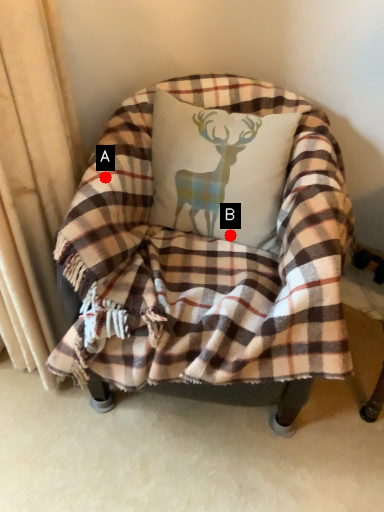
Question: Two points are circled on the image, labeled by A and B beside each circle. Which point is further to the camera?

Choices:
 (A) A is further
 (B) B is further

Answer: (B)